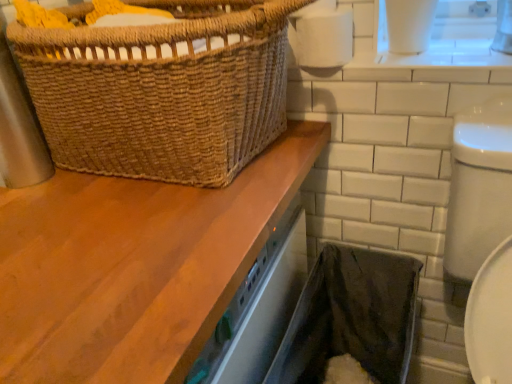
Identify the location of wooden countertop at upper left. The width and height of the screenshot is (512, 384). tap(133, 266).

The image size is (512, 384). What are the coordinates of `brown woven basket at upper left` in the screenshot? It's located at (162, 90).

Locate an element on the screen. The width and height of the screenshot is (512, 384). black fabric laundry basket at lower right is located at coordinates (351, 317).

Is wooden countertop at upper left aimed at white matte toilet paper at upper right?

No, wooden countertop at upper left is not oriented towards white matte toilet paper at upper right.

Does point (292, 152) lie behind point (318, 64)?

No, it is not.

Which is more to the left, wooden countertop at upper left or white matte toilet paper at upper right?

wooden countertop at upper left is more to the left.

Can you confirm if white matte toilet paper at upper right is smaller than black fabric laundry basket at lower right?

Yes.

Between white matte toilet paper at upper right and black fabric laundry basket at lower right, which one appears on the left side from the viewer's perspective?

Positioned to the left is white matte toilet paper at upper right.

I want to click on laundry basket in front of the white matte toilet paper at upper right, so click(x=351, y=317).

Looking at this image, can you confirm if white matte toilet paper at upper right is thinner than black fabric laundry basket at lower right?

Indeed, white matte toilet paper at upper right has a lesser width compared to black fabric laundry basket at lower right.

From the image's perspective, is black fabric laundry basket at lower right under brown woven basket at upper left?

Yes, from the image's perspective, black fabric laundry basket at lower right is below brown woven basket at upper left.

You are a GUI agent. You are given a task and a screenshot of the screen. Output one action in this format:
    pyautogui.click(x=<x>, y=<y>)
    Task: Click on the picnic basket lying on the left of black fabric laundry basket at lower right
    This screenshot has width=512, height=384.
    Given the screenshot: What is the action you would take?
    pyautogui.click(x=162, y=90)

Is black fabric laundry basket at lower right turned away from brown woven basket at upper left?

That's not correct — black fabric laundry basket at lower right is not looking away from brown woven basket at upper left.

Considering the positions of points (106, 174) and (300, 24), is point (106, 174) farther from camera compared to point (300, 24)?

No, it is in front of (300, 24).

In the scene shown: Considering the relative sizes of brown woven basket at upper left and white matte toilet paper at upper right in the image provided, is brown woven basket at upper left wider than white matte toilet paper at upper right?

Yes, brown woven basket at upper left is wider than white matte toilet paper at upper right.

What's the angular difference between brown woven basket at upper left and white matte toilet paper at upper right's facing directions?

The angular difference between brown woven basket at upper left and white matte toilet paper at upper right is 0.00164 degrees.

Does brown woven basket at upper left touch white matte toilet paper at upper right?

brown woven basket at upper left is not next to white matte toilet paper at upper right, and they're not touching.

Is black fabric laundry basket at lower right to the right of wooden countertop at upper left from the viewer's perspective?

Indeed, black fabric laundry basket at lower right is positioned on the right side of wooden countertop at upper left.

Is black fabric laundry basket at lower right touching wooden countertop at upper left?

No.

Is black fabric laundry basket at lower right not inside wooden countertop at upper left?

Yes, black fabric laundry basket at lower right is located beyond the bounds of wooden countertop at upper left.

Which is in front, point (384, 381) or point (29, 382)?

Point (29, 382)

I want to click on laundry basket directly beneath the white matte toilet paper at upper right (from a real-world perspective), so click(351, 317).

From a real-world perspective, does black fabric laundry basket at lower right stand above white matte toilet paper at upper right?

No, from a real-world perspective, black fabric laundry basket at lower right is not over white matte toilet paper at upper right

Considering the relative sizes of black fabric laundry basket at lower right and white matte toilet paper at upper right in the image provided, is black fabric laundry basket at lower right taller than white matte toilet paper at upper right?

Yes.

Is black fabric laundry basket at lower right aimed at white matte toilet paper at upper right?

No, black fabric laundry basket at lower right is not aimed at white matte toilet paper at upper right.

Would you say white matte toilet paper at upper right is outside brown woven basket at upper left?

Indeed, white matte toilet paper at upper right is completely outside brown woven basket at upper left.

From a real-world perspective, is white matte toilet paper at upper right over brown woven basket at upper left?

Yes, from a real-world perspective, white matte toilet paper at upper right is above brown woven basket at upper left.

You are a GUI agent. You are given a task and a screenshot of the screen. Output one action in this format:
    pyautogui.click(x=<x>, y=<y>)
    Task: Click on the bathroom cabinet on the left of the white matte toilet paper at upper right
    The height and width of the screenshot is (384, 512).
    Given the screenshot: What is the action you would take?
    [133, 266]

Locate an element on the screen. laundry basket beneath the white matte toilet paper at upper right (from a real-world perspective) is located at coordinates (351, 317).

Estimate the real-world distances between objects in this image. Which object is further from black fabric laundry basket at lower right, wooden countertop at upper left or brown woven basket at upper left?

brown woven basket at upper left.

From the image, which object appears to be farther from brown woven basket at upper left, wooden countertop at upper left or black fabric laundry basket at lower right?

Among the two, black fabric laundry basket at lower right is located further to brown woven basket at upper left.

From the image, which object appears to be nearer to white matte toilet paper at upper right, wooden countertop at upper left or brown woven basket at upper left?

Among the two, brown woven basket at upper left is located nearer to white matte toilet paper at upper right.

Which object lies nearer to the anchor point brown woven basket at upper left, wooden countertop at upper left or white matte toilet paper at upper right?

wooden countertop at upper left is closer to brown woven basket at upper left.

Consider the image. Looking at the image, which one is located closer to wooden countertop at upper left, white matte toilet paper at upper right or black fabric laundry basket at lower right?

Based on the image, black fabric laundry basket at lower right appears to be nearer to wooden countertop at upper left.

Based on their spatial positions, is wooden countertop at upper left or black fabric laundry basket at lower right closer to white matte toilet paper at upper right?

wooden countertop at upper left is positioned closer to the anchor white matte toilet paper at upper right.

Considering their positions, is black fabric laundry basket at lower right positioned further to brown woven basket at upper left than wooden countertop at upper left?

The object further to brown woven basket at upper left is black fabric laundry basket at lower right.

Considering their positions, is white matte toilet paper at upper right positioned closer to brown woven basket at upper left than wooden countertop at upper left?

Among the two, wooden countertop at upper left is located nearer to brown woven basket at upper left.

You are a GUI agent. You are given a task and a screenshot of the screen. Output one action in this format:
    pyautogui.click(x=<x>, y=<y>)
    Task: Click on the bathroom cabinet between brown woven basket at upper left and black fabric laundry basket at lower right in the up-down direction
    The width and height of the screenshot is (512, 384).
    Given the screenshot: What is the action you would take?
    pyautogui.click(x=133, y=266)

The image size is (512, 384). Identify the location of picnic basket between wooden countertop at upper left and white matte toilet paper at upper right in the front-back direction. (162, 90).

You are a GUI agent. You are given a task and a screenshot of the screen. Output one action in this format:
    pyautogui.click(x=<x>, y=<y>)
    Task: Click on the bathroom cabinet that lies between white matte toilet paper at upper right and black fabric laundry basket at lower right from top to bottom
    
    Given the screenshot: What is the action you would take?
    pyautogui.click(x=133, y=266)

This screenshot has height=384, width=512. I want to click on picnic basket that lies between white matte toilet paper at upper right and black fabric laundry basket at lower right from top to bottom, so click(162, 90).